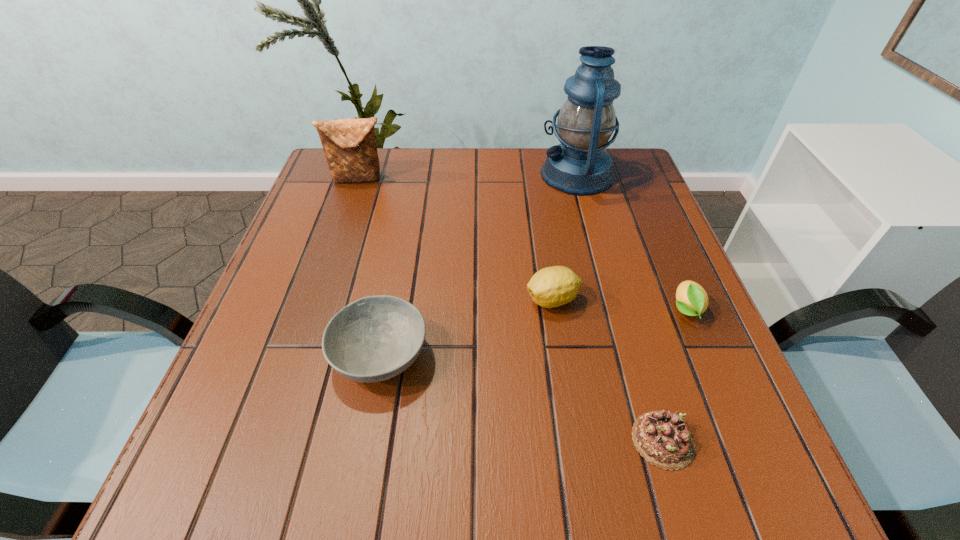
The width and height of the screenshot is (960, 540). Identify the location of free space located 0.370m on the face of the lantern. (406, 174).

Where is `free spot located on the open side of the second tallest object`? The height and width of the screenshot is (540, 960). free spot located on the open side of the second tallest object is located at coordinates (339, 239).

Locate an element on the screen. The width and height of the screenshot is (960, 540). free space located at the stem end of the left lemon is located at coordinates (372, 300).

The image size is (960, 540). Identify the location of vacant area situated 0.320m at the stem end of the left lemon. (368, 300).

You are a GUI agent. You are given a task and a screenshot of the screen. Output one action in this format:
    pyautogui.click(x=<x>, y=<y>)
    Task: Click on the free space located at the stem end of the left lemon
    Image resolution: width=960 pixels, height=540 pixels.
    Given the screenshot: What is the action you would take?
    pyautogui.click(x=397, y=300)

In order to click on vacant space located on the left of the bowl in this screenshot , I will do `click(244, 355)`.

You are a GUI agent. You are given a task and a screenshot of the screen. Output one action in this format:
    pyautogui.click(x=<x>, y=<y>)
    Task: Click on the free space located with leaves positioned above the shorter lemon
    The height and width of the screenshot is (540, 960).
    Given the screenshot: What is the action you would take?
    pos(763,494)

The width and height of the screenshot is (960, 540). In order to click on free space located 0.160m on the back of the shortest object in this screenshot , I will do `click(632, 333)`.

This screenshot has width=960, height=540. What are the coordinates of `lantern situated at the far edge` in the screenshot? It's located at (580, 166).

Locate an element on the screen. The image size is (960, 540). clutch bag located at the far edge is located at coordinates (349, 145).